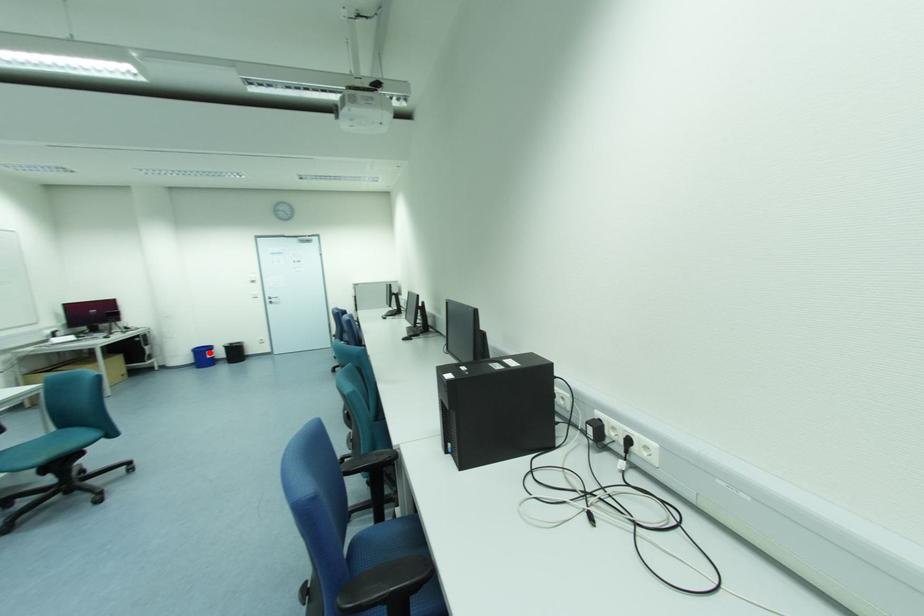
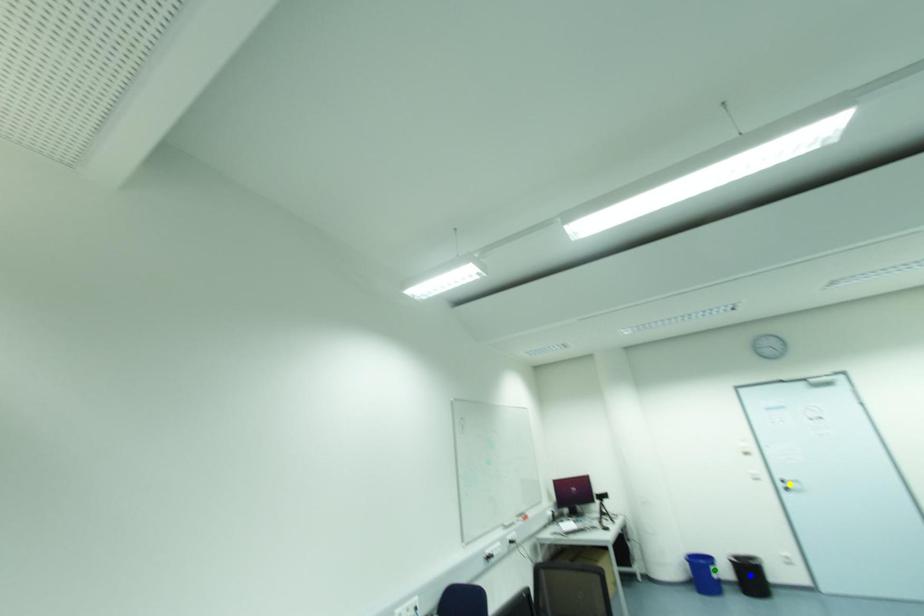
Question: I am providing you with two images of the same scene from different viewpoints. A red point is marked on the first image. You are given multiple points on the second image. Which point in image 2 is actually the same real-world point as the red point in image 1?

Choices:
 (A) yellow point
 (B) blue point
 (C) green point

Answer: (C)